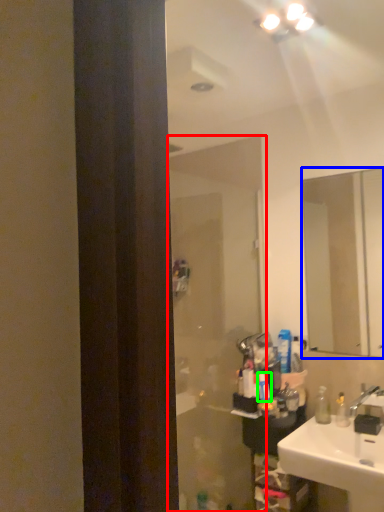
Question: Considering the real-world distances, which object is farthest from screen door (highlighted by a red box)? mirror (highlighted by a blue box) or toiletry (highlighted by a green box)?

Choices:
 (A) mirror
 (B) toiletry

Answer: (A)